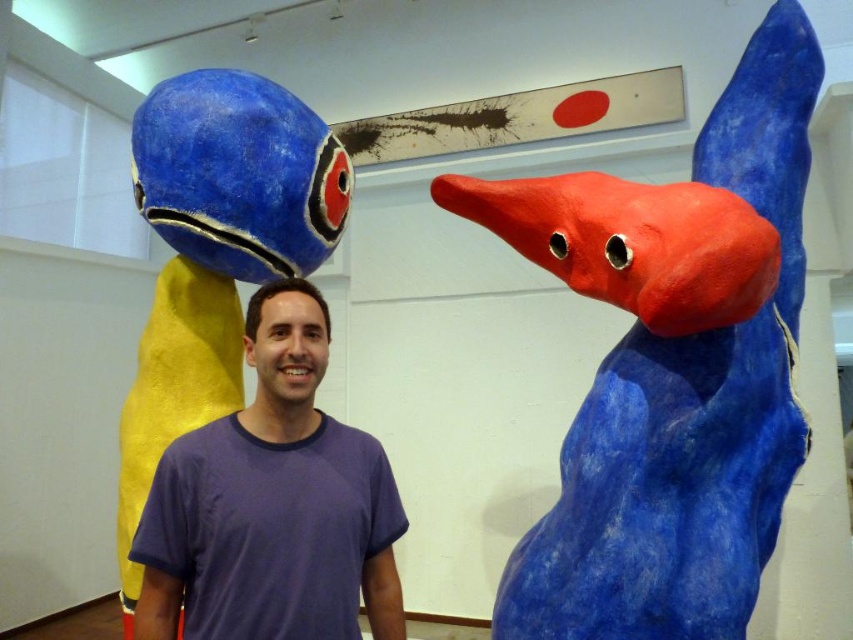
The height and width of the screenshot is (640, 853). Describe the element at coordinates (672, 365) in the screenshot. I see `matte blue sculpture at upper right` at that location.

Can you confirm if matte blue sculpture at upper right is bigger than matte purple shirt at center?

Yes, matte blue sculpture at upper right is bigger than matte purple shirt at center.

Is point (613, 488) in front of point (326, 282)?

Yes, point (613, 488) is closer to viewer.

The image size is (853, 640). What are the coordinates of `matte blue sculpture at upper right` in the screenshot? It's located at pyautogui.click(x=672, y=365).

Which is more to the right, matte blue sculpture at upper right or purple cotton t-shirt at center?

Positioned to the right is matte blue sculpture at upper right.

Measure the distance between matte blue sculpture at upper right and camera.

1.70 meters

Between point (677, 365) and point (247, 490), which one is positioned behind?

Point (677, 365)

Locate an element on the screen. This screenshot has width=853, height=640. matte blue sculpture at upper right is located at coordinates (672, 365).

Who is lower down, purple cotton t-shirt at center or matte purple shirt at center?

purple cotton t-shirt at center is lower down.

This screenshot has width=853, height=640. I want to click on purple cotton t-shirt at center, so click(271, 504).

Is point (279, 460) farther from camera compared to point (329, 384)?

That is False.

This screenshot has width=853, height=640. In order to click on purple cotton t-shirt at center in this screenshot , I will do click(271, 504).